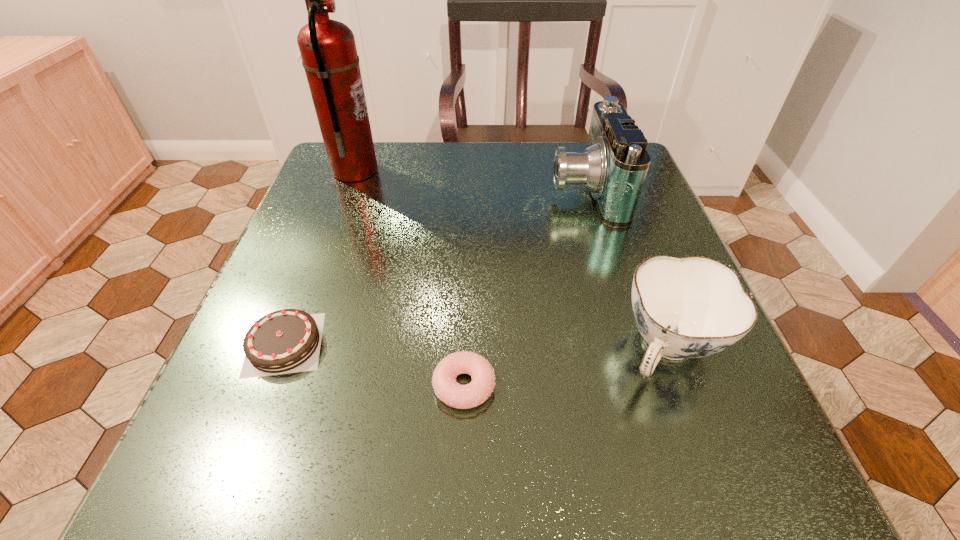
Where is `vacant space located on the back of the chocolate cake`? The width and height of the screenshot is (960, 540). vacant space located on the back of the chocolate cake is located at coordinates (323, 245).

Where is `free space located on the back of the third object from right to left`? The height and width of the screenshot is (540, 960). free space located on the back of the third object from right to left is located at coordinates (467, 300).

Find the location of a particular element. fire extinguisher that is at the far edge is located at coordinates (328, 50).

Find the location of a particular element. camcorder that is at the far edge is located at coordinates (614, 165).

Where is `fire extinguisher that is at the left edge`? This screenshot has height=540, width=960. fire extinguisher that is at the left edge is located at coordinates (328, 50).

The height and width of the screenshot is (540, 960). Find the location of `chocolate cake at the left edge`. chocolate cake at the left edge is located at coordinates (285, 341).

Identify the location of camcorder positioned at the right edge. This screenshot has width=960, height=540. (614, 165).

The image size is (960, 540). In order to click on chinaware that is at the right edge in this screenshot , I will do `click(692, 307)`.

You are a GUI agent. You are given a task and a screenshot of the screen. Output one action in this format:
    pyautogui.click(x=<x>, y=<y>)
    Task: Click on the object located in the far left corner section of the desktop
    The height and width of the screenshot is (540, 960).
    Given the screenshot: What is the action you would take?
    pyautogui.click(x=328, y=50)

The image size is (960, 540). I want to click on object that is positioned at the far right corner, so click(x=614, y=165).